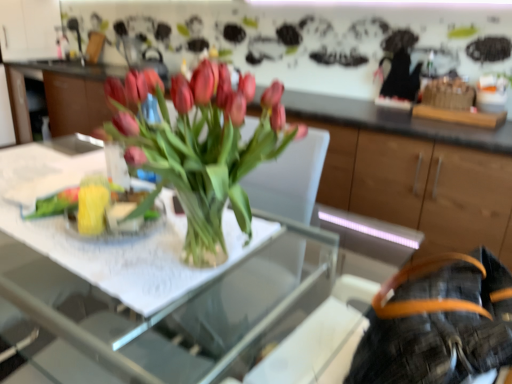
What do you see at coordinates (143, 289) in the screenshot? I see `clear glass table at center` at bounding box center [143, 289].

Where is `clear glass vase at center`? This screenshot has height=384, width=512. clear glass vase at center is located at coordinates (116, 165).

What do you see at coordinates (116, 165) in the screenshot? The height and width of the screenshot is (384, 512). I see `clear glass vase at center` at bounding box center [116, 165].

This screenshot has height=384, width=512. In order to click on clear glass table at center in this screenshot , I will do `click(143, 289)`.

Is clear glass table at center directly adjacent to clear glass vase at center?

clear glass table at center and clear glass vase at center are not in contact.

Which is more to the left, clear glass table at center or clear glass vase at center?

clear glass vase at center is more to the left.

Considering the sizes of objects clear glass table at center and clear glass vase at center in the image provided, who is taller, clear glass table at center or clear glass vase at center?

Standing taller between the two is clear glass table at center.

Is clear glass table at center positioned behind clear glass vase at center?

No, clear glass table at center is in front of clear glass vase at center.

From a real-world perspective, is matte wood cabinet at center physically located above or below orange leather belt at lower right?

Clearly, from a real-world perspective, matte wood cabinet at center is below orange leather belt at lower right.

This screenshot has width=512, height=384. Identify the location of cabinetry above the orange leather belt at lower right (from the image's perspective). point(421,178).

Is point (451, 233) farther from viewer compared to point (444, 273)?

Yes, it is behind point (444, 273).

Does matte wood cabinet at center have a larger size compared to orange leather belt at lower right?

Indeed, matte wood cabinet at center has a larger size compared to orange leather belt at lower right.

Can we say clear glass vase at center lies outside orange leather belt at lower right?

Yes, clear glass vase at center is outside of orange leather belt at lower right.

Between point (111, 154) and point (485, 303), which one is positioned behind?

The point (111, 154) is farther from the camera.

Identify the location of vase positioned vertically above the orange leather belt at lower right (from a real-world perspective). (116, 165).

How far apart are clear glass vase at center and orange leather belt at lower right?

The distance of clear glass vase at center from orange leather belt at lower right is 33.62 inches.

Which is correct: orange leather belt at lower right is inside clear glass table at center, or outside of it?

orange leather belt at lower right is spatially situated outside clear glass table at center.

Visually, is orange leather belt at lower right positioned to the left or to the right of clear glass table at center?

orange leather belt at lower right is positioned on clear glass table at center's right side.

Measure the distance between orange leather belt at lower right and clear glass table at center.

orange leather belt at lower right and clear glass table at center are 51.40 centimeters apart from each other.

In terms of size, does orange leather belt at lower right appear bigger or smaller than clear glass table at center?

orange leather belt at lower right is smaller than clear glass table at center.

Between clear glass vase at center and matte wood cabinet at center, which one appears on the right side from the viewer's perspective?

Positioned to the right is matte wood cabinet at center.

Is matte wood cabinet at center completely or partially inside clear glass vase at center?

No, matte wood cabinet at center is not surrounded by clear glass vase at center.

Does clear glass vase at center have a smaller size compared to matte wood cabinet at center?

Yes.

Is matte wood cabinet at center next to clear glass vase at center and touching it?

No, matte wood cabinet at center is not next to clear glass vase at center.

Is matte wood cabinet at center in front of or behind clear glass vase at center in the image?

matte wood cabinet at center is positioned closer to the viewer than clear glass vase at center.

Is matte wood cabinet at center positioned with its back to clear glass vase at center?

That's not correct — matte wood cabinet at center is not looking away from clear glass vase at center.

Does point (418, 189) appear closer or farther from the camera than point (115, 167)?

Point (418, 189) is farther from the camera than point (115, 167).

Between clear glass vase at center and clear glass table at center, which one appears on the right side from the viewer's perspective?

Positioned to the right is clear glass table at center.

Considering the sizes of objects clear glass vase at center and clear glass table at center in the image provided, who is thinner, clear glass vase at center or clear glass table at center?

clear glass vase at center is thinner.

From the image's perspective, which one is positioned higher, clear glass vase at center or clear glass table at center?

clear glass vase at center.

Would you say clear glass vase at center is a long distance from clear glass table at center?

No, clear glass vase at center is not far from clear glass table at center.

Locate an element on the screen. vase above the clear glass table at center (from a real-world perspective) is located at coordinates click(x=116, y=165).

Locate an element on the screen. Image resolution: width=512 pixels, height=384 pixels. cabinetry on the left of orange leather belt at lower right is located at coordinates (421, 178).

Considering their positions, is matte wood cabinet at center positioned closer to clear glass vase at center than clear glass table at center?

clear glass table at center.

Which object lies further to the anchor point matte wood cabinet at center, clear glass vase at center or clear glass table at center?

clear glass vase at center is further to matte wood cabinet at center.

Estimate the real-world distances between objects in this image. Which object is closer to matte wood cabinet at center, clear glass vase at center or orange leather belt at lower right?

orange leather belt at lower right is positioned closer to the anchor matte wood cabinet at center.

Looking at the image, which one is located closer to orange leather belt at lower right, clear glass table at center or clear glass vase at center?

Based on the image, clear glass table at center appears to be nearer to orange leather belt at lower right.

When comparing their distances from matte wood cabinet at center, does orange leather belt at lower right or clear glass vase at center seem further?

clear glass vase at center.

Looking at the image, which one is located further to clear glass table at center, matte wood cabinet at center or clear glass vase at center?

matte wood cabinet at center.

Estimate the real-world distances between objects in this image. Which object is further from clear glass table at center, orange leather belt at lower right or clear glass vase at center?

Among the two, orange leather belt at lower right is located further to clear glass table at center.

Looking at the image, which one is located further to clear glass vase at center, orange leather belt at lower right or clear glass table at center?

Based on the image, orange leather belt at lower right appears to be further to clear glass vase at center.

Where is `back between clear glass table at center and clear glass vase at center along the z-axis`? back between clear glass table at center and clear glass vase at center along the z-axis is located at coordinates (438, 323).

This screenshot has width=512, height=384. Find the location of `cabinetry between clear glass table at center and clear glass vase at center from front to back`. cabinetry between clear glass table at center and clear glass vase at center from front to back is located at coordinates (421, 178).

This screenshot has height=384, width=512. Find the location of `back between clear glass table at center and matte wood cabinet at center along the z-axis`. back between clear glass table at center and matte wood cabinet at center along the z-axis is located at coordinates [x=438, y=323].

Locate an element on the screen. The width and height of the screenshot is (512, 384). cabinetry between orange leather belt at lower right and clear glass vase at center in the front-back direction is located at coordinates (421, 178).